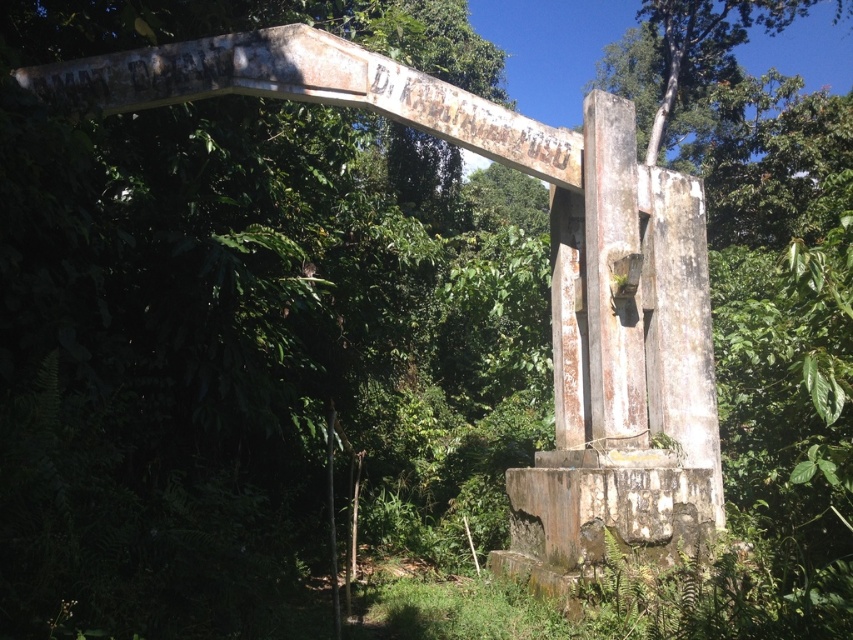
Question: In this image, where is rusty concrete monument at center located relative to green leafy tree at upper center?

Choices:
 (A) below
 (B) above

Answer: (A)

Question: Which point is farther from the camera taking this photo?

Choices:
 (A) (590, 97)
 (B) (606, 64)

Answer: (B)

Question: In this image, where is rusty concrete monument at center located relative to green leafy tree at upper center?

Choices:
 (A) right
 (B) left

Answer: (B)

Question: Which object appears farthest from the camera in this image?

Choices:
 (A) rusty concrete monument at center
 (B) green leafy tree at upper center

Answer: (B)

Question: Which point is closer to the camera?

Choices:
 (A) green leafy tree at upper center
 (B) rusty concrete monument at center

Answer: (B)

Question: Can you confirm if rusty concrete monument at center is positioned to the left of green leafy tree at upper center?

Choices:
 (A) yes
 (B) no

Answer: (A)